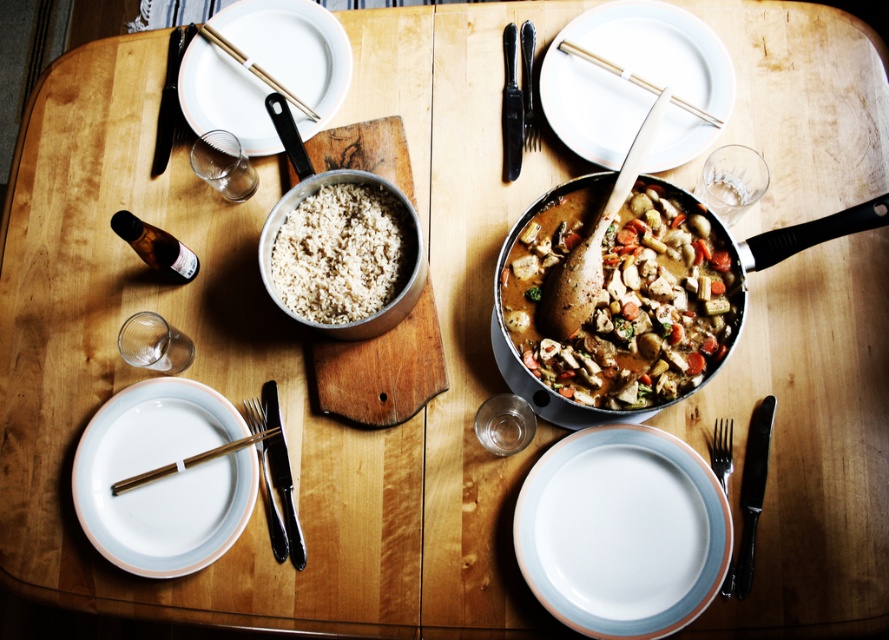
Question: Considering the relative positions of white glossy plate at lower center and black plastic knife at lower right in the image provided, where is white glossy plate at lower center located with respect to black plastic knife at lower right?

Choices:
 (A) right
 (B) left

Answer: (B)

Question: Which of the following is the farthest from the observer?

Choices:
 (A) (506, 84)
 (B) (702, 189)

Answer: (A)

Question: Does white matte plate at upper left have a greater width compared to black metal fork at lower left?

Choices:
 (A) yes
 (B) no

Answer: (A)

Question: Which object is the closest to the transparent glass at upper right?

Choices:
 (A) black metal knife at upper center
 (B) brown matte stew at center
 (C) black metal knife at upper left

Answer: (B)

Question: Which is nearer to the black metal knife at upper center?

Choices:
 (A) gold metallic chopsticks at upper center
 (B) brown wood chopsticks at lower left

Answer: (A)

Question: Does white glossy plate at lower center appear on the right side of white matte rice bowl at center?

Choices:
 (A) no
 (B) yes

Answer: (B)